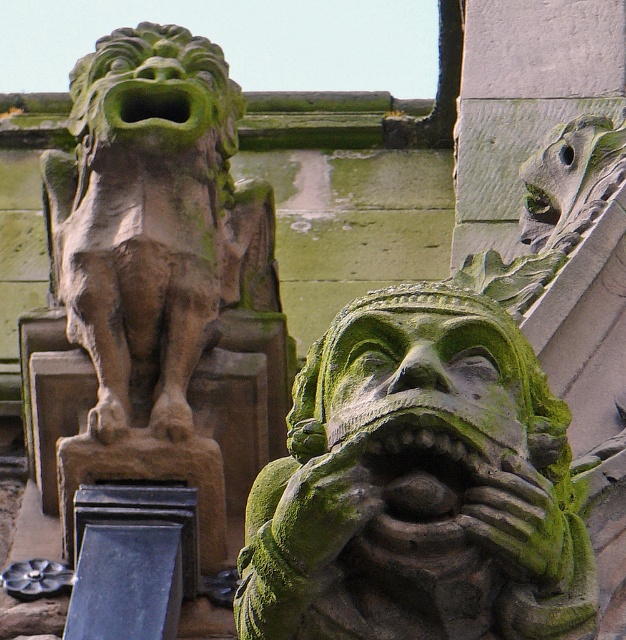
You are an architect examining the two stone carvings in the image. Both are positioned at the center of the structure. Which of the two, the green mossy stone lion at center or the green mossy stone face at center, would require more material to create due to its size?

The green mossy stone lion at center has a larger size compared to the green mossy stone face at center, so it would require more material to create.

You are an architect inspecting the cathedral facade. You notice the green mossy stone lion at center and the green mossy stone face at center. Which one is positioned higher on the structure?

The green mossy stone lion at center is positioned higher than the green mossy stone face at center on the cathedral facade.